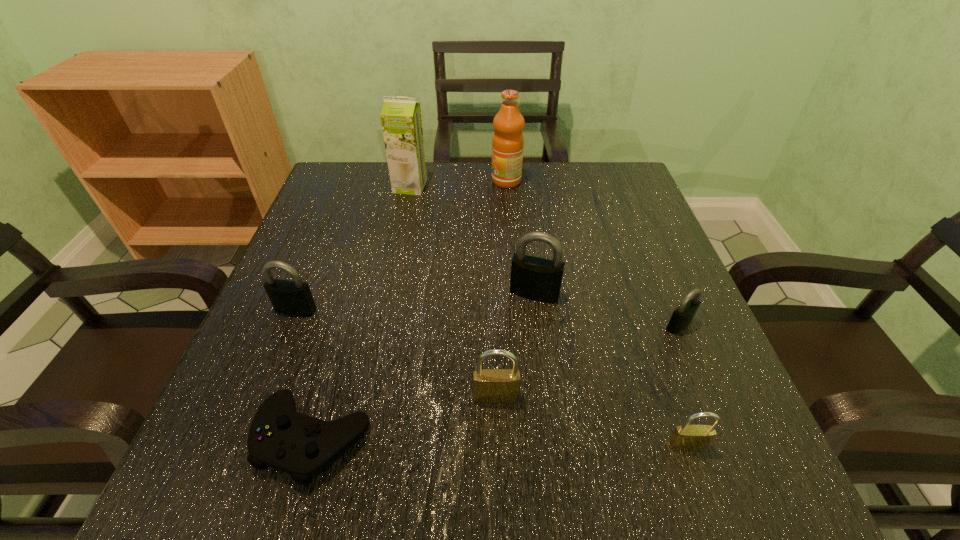
Select which black padlock appears as the closest to the leftmost black padlock. Please provide its 2D coordinates. Your answer should be formatted as a tuple, i.e. [(x, y)], where the tuple contains the x and y coordinates of a point satisfying the conditions above.

[(538, 279)]

In order to click on black padlock that is the second nearest to the leftmost black padlock in this screenshot , I will do `click(683, 315)`.

At what (x,y) coordinates should I click in order to perform the action: click on blank area in the image that satisfies the following two spatial constraints: 1. on the back side of the sixth shortest object; 2. on the left side of the leftmost black padlock. Please return your answer as a coordinate pair (x, y). The width and height of the screenshot is (960, 540). Looking at the image, I should click on pos(302,293).

Locate an element on the screen. The image size is (960, 540). free space that satisfies the following two spatial constraints: 1. on the back side of the second black padlock from left to right; 2. on the left side of the leftmost padlock is located at coordinates pos(302,293).

Locate an element on the screen. free space that satisfies the following two spatial constraints: 1. on the label side of the fruit juice; 2. on the left side of the rightmost black padlock is located at coordinates (517, 325).

The width and height of the screenshot is (960, 540). I want to click on vacant area in the image that satisfies the following two spatial constraints: 1. on the back side of the fourth nearest object; 2. on the label side of the fruit juice, so click(x=618, y=181).